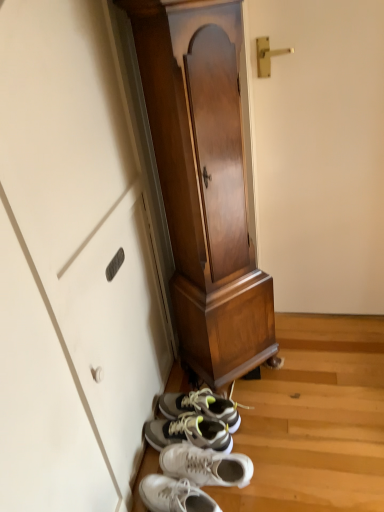
Question: In terms of height, does wooden cabinet at center look taller or shorter compared to white leather sneakers at lower center?

Choices:
 (A) short
 (B) tall

Answer: (B)

Question: From the image's perspective, is wooden cabinet at center located above or below white leather sneakers at lower center?

Choices:
 (A) above
 (B) below

Answer: (A)

Question: Considering the positions of point (203, 53) and point (147, 493), is point (203, 53) closer or farther from the camera than point (147, 493)?

Choices:
 (A) farther
 (B) closer

Answer: (B)

Question: From a real-world perspective, is white leather sneakers at lower center positioned above or below wooden cabinet at center?

Choices:
 (A) above
 (B) below

Answer: (B)

Question: Choose the correct answer: Is white leather sneakers at lower center inside wooden cabinet at center or outside it?

Choices:
 (A) outside
 (B) inside

Answer: (A)

Question: From the image's perspective, relative to wooden cabinet at center, is white leather sneakers at lower center above or below?

Choices:
 (A) above
 (B) below

Answer: (B)

Question: In terms of height, does white leather sneakers at lower center look taller or shorter compared to wooden cabinet at center?

Choices:
 (A) short
 (B) tall

Answer: (A)